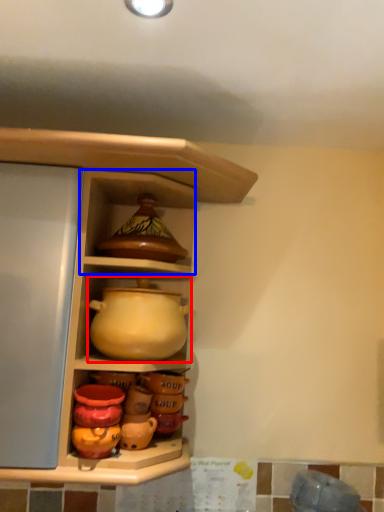
Question: Which object is closer to the camera taking this photo, jug (highlighted by a red box) or cabinet (highlighted by a blue box)?

Choices:
 (A) jug
 (B) cabinet

Answer: (A)